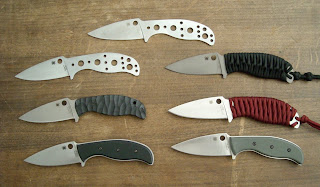
At what (x,y) coordinates should I click in order to perform the action: click on table. Please return your answer as a coordinate pair (x, y). Looking at the image, I should click on (53, 50).